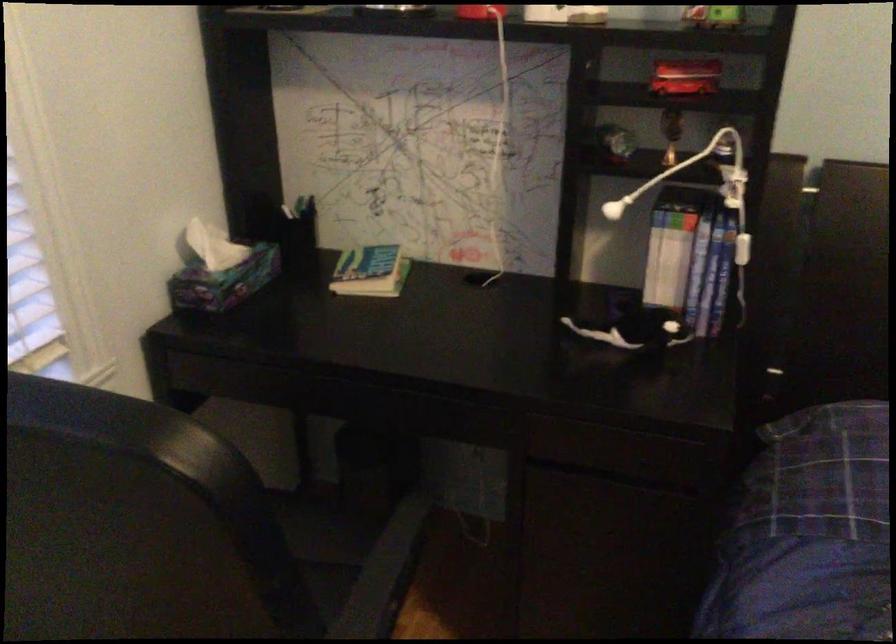
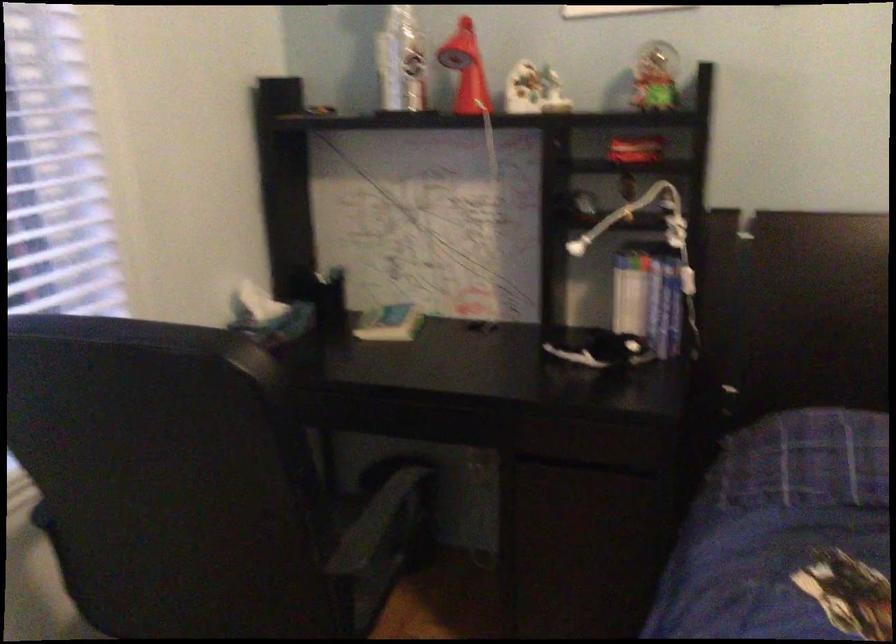
Locate, in the second image, the point that corresponds to the point at 703,278 in the first image.

(664, 307)